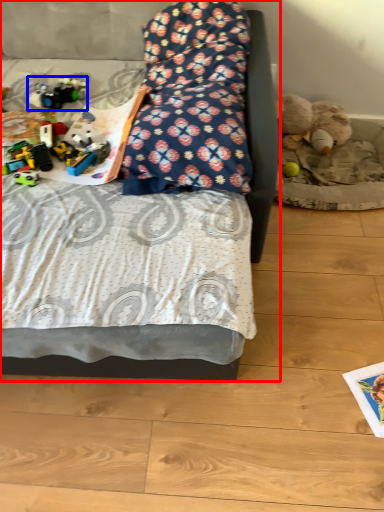
Question: Which object is further to the camera taking this photo, bed (highlighted by a red box) or toy (highlighted by a blue box)?

Choices:
 (A) bed
 (B) toy

Answer: (B)